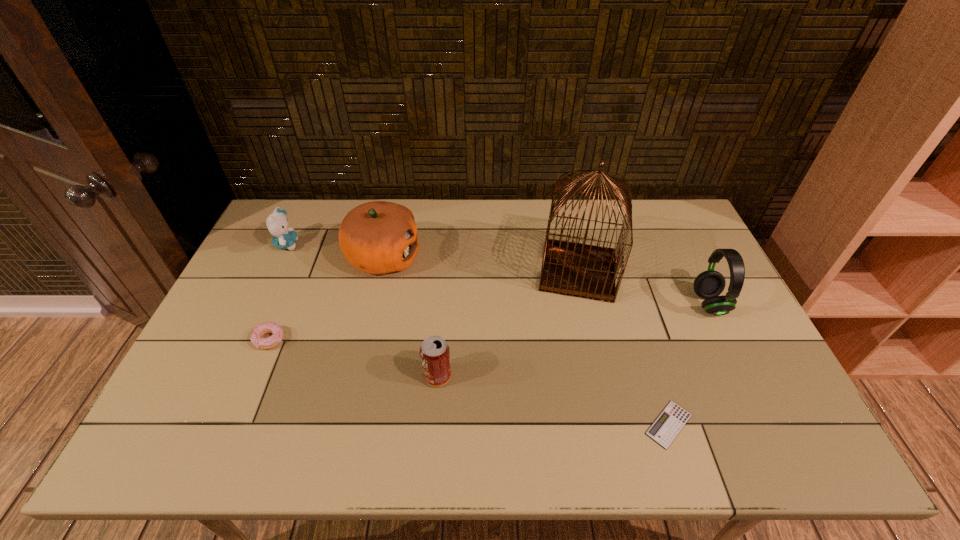
At what (x,y) coordinates should I click in order to perform the action: click on object identified as the closest to the fourth object from left to right. Please return your answer as a coordinate pair (x, y). The width and height of the screenshot is (960, 540). Looking at the image, I should click on (378, 237).

Identify which object is the closest to the tallest object. Please provide its 2D coordinates. Your answer should be formatted as a tuple, i.e. [(x, y)], where the tuple contains the x and y coordinates of a point satisfying the conditions above.

[(709, 284)]

Where is `vacant area that satisfies the following two spatial constraints: 1. on the face of the kitten; 2. on the right side of the fourth object from right to left`? This screenshot has width=960, height=540. vacant area that satisfies the following two spatial constraints: 1. on the face of the kitten; 2. on the right side of the fourth object from right to left is located at coordinates (225, 376).

The image size is (960, 540). I want to click on vacant space that satisfies the following two spatial constraints: 1. on the face of the kitten; 2. on the left side of the sixth farthest object, so click(x=225, y=376).

What are the coordinates of `free point that satisfies the following two spatial constraints: 1. on the back side of the birdcage; 2. on the face of the kitten` in the screenshot? It's located at (572, 245).

The width and height of the screenshot is (960, 540). In order to click on vacant point that satisfies the following two spatial constraints: 1. on the front side of the nearest object; 2. on the right side of the fourth object from left to right in this screenshot , I will do `click(434, 424)`.